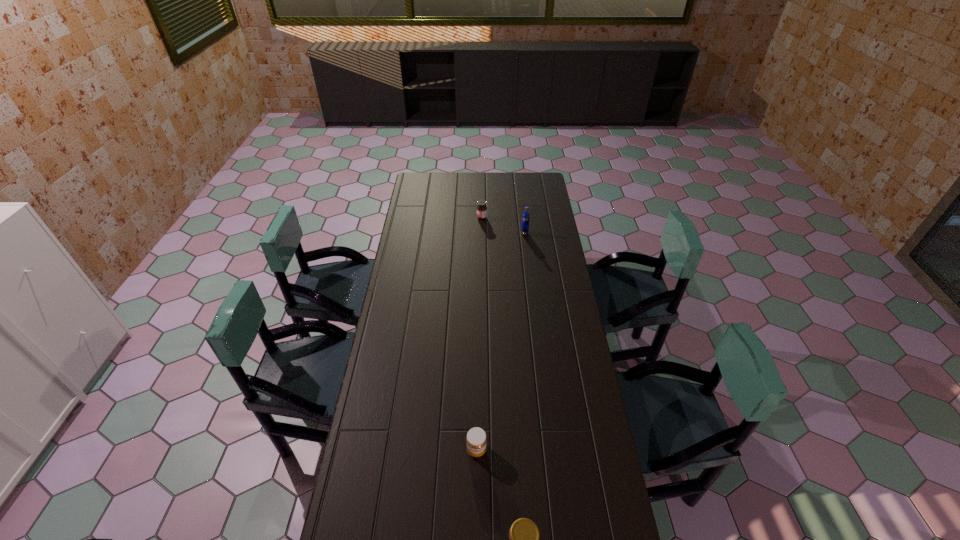
At what (x,y) coordinates should I click in order to perform the action: click on vacant space at the left edge of the desktop. Please return your answer as a coordinate pair (x, y). Image resolution: width=960 pixels, height=540 pixels. Looking at the image, I should click on (396, 449).

This screenshot has height=540, width=960. In the image, there is a desktop. Find the location of `free space at the right edge`. free space at the right edge is located at coordinates (556, 436).

What are the coordinates of `free space at the far right corner` in the screenshot? It's located at (542, 185).

This screenshot has width=960, height=540. I want to click on free space between the tallest object and the second nearest object, so click(500, 341).

Find the location of a particular element. The image size is (960, 540). vacant space that's between the rightmost object and the farthest jam is located at coordinates (503, 226).

Locate an element on the screen. The image size is (960, 540). free point between the second nearest jam and the farthest object is located at coordinates (479, 334).

In order to click on free point between the farthest object and the rightmost object in this screenshot , I will do `click(503, 226)`.

In order to click on free space between the second farthest jam and the vodka in this screenshot , I will do `click(500, 341)`.

Find the location of a particular element. vacant point located between the second nearest jam and the farthest jam is located at coordinates (479, 334).

This screenshot has height=540, width=960. What are the coordinates of `object that stands as the third closest to the second farthest jam` in the screenshot? It's located at (481, 208).